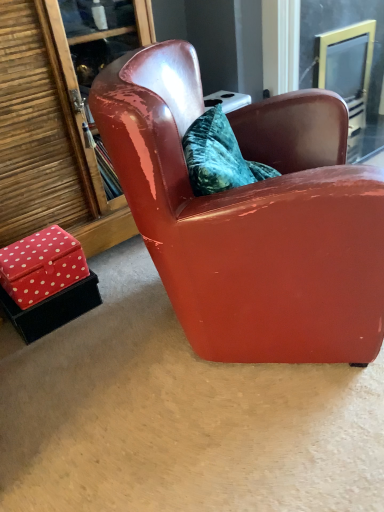
You are a GUI agent. You are given a task and a screenshot of the screen. Output one action in this format:
    pyautogui.click(x=<x>, y=<y>)
    Task: Click on the free space in front of red polka dot fabric box at lower left, the 1th box ordered from the bottom
    The height and width of the screenshot is (512, 384).
    Given the screenshot: What is the action you would take?
    pyautogui.click(x=53, y=359)